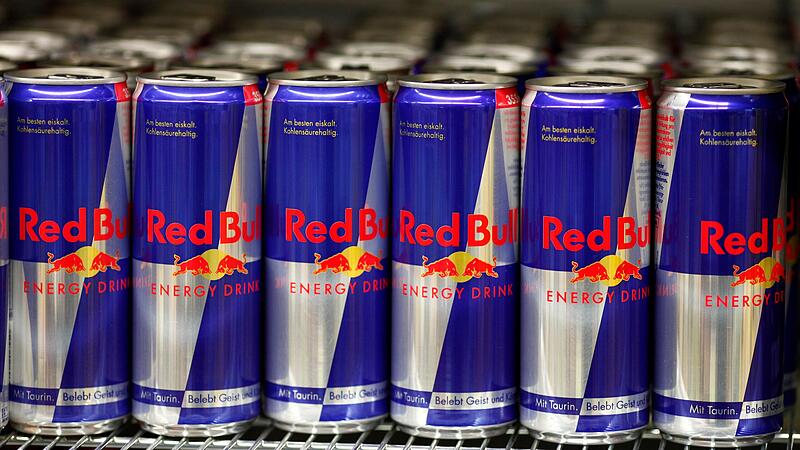
Image resolution: width=800 pixels, height=450 pixels. Find the location of `wire rack`. wire rack is located at coordinates (385, 440).